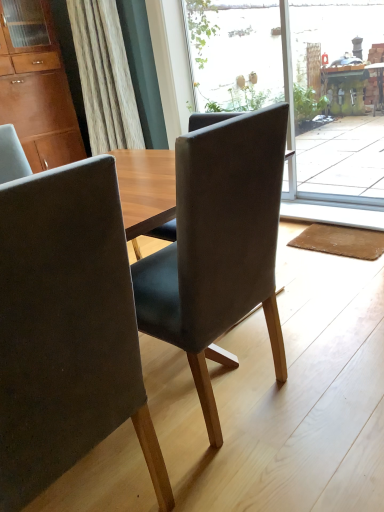
The height and width of the screenshot is (512, 384). What are the coordinates of `free location to the right of suede-like gray chair at center, positioned as the 1th chair in right-to-left order` in the screenshot? It's located at (325, 370).